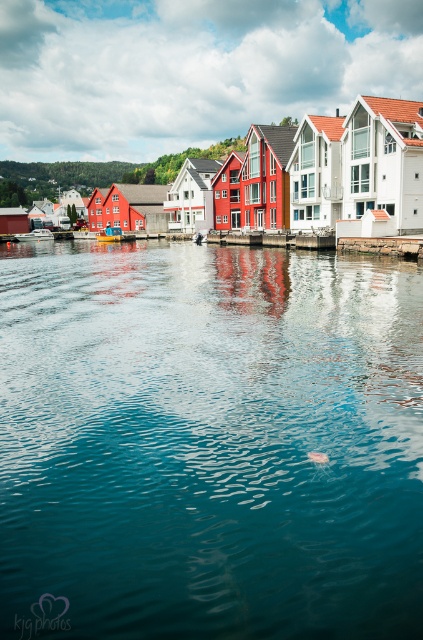
Which is more to the left, blue water at center or blue plastic boat at center?

From the viewer's perspective, blue plastic boat at center appears more on the left side.

Does point (117, 557) lie in front of point (107, 241)?

Yes, point (117, 557) is closer to viewer.

Identify the location of blue water at center. (208, 444).

Can you confirm if white glossy boat at center is bigger than blue plastic boat at center?

No.

Does white glossy boat at center have a greater width compared to blue plastic boat at center?

In fact, white glossy boat at center might be narrower than blue plastic boat at center.

Measure the distance between point [43,234] and camera.

They are 144.26 meters apart.

What are the coordinates of `white glossy boat at center` in the screenshot? It's located at 35,234.

Can you confirm if blue water at center is thinner than white glossy boat at center?

Incorrect, blue water at center's width is not less than white glossy boat at center's.

Which is behind, point (285, 284) or point (41, 230)?

Point (41, 230)

At what (x,y) coordinates should I click in order to perform the action: click on blue water at center. Please return your answer as a coordinate pair (x, y). Image resolution: width=423 pixels, height=640 pixels. Looking at the image, I should click on (208, 444).